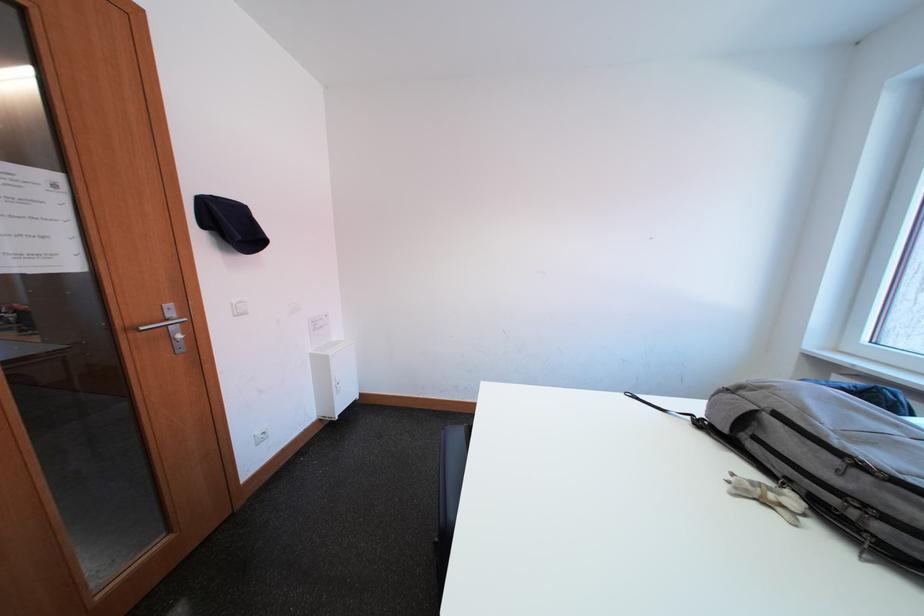
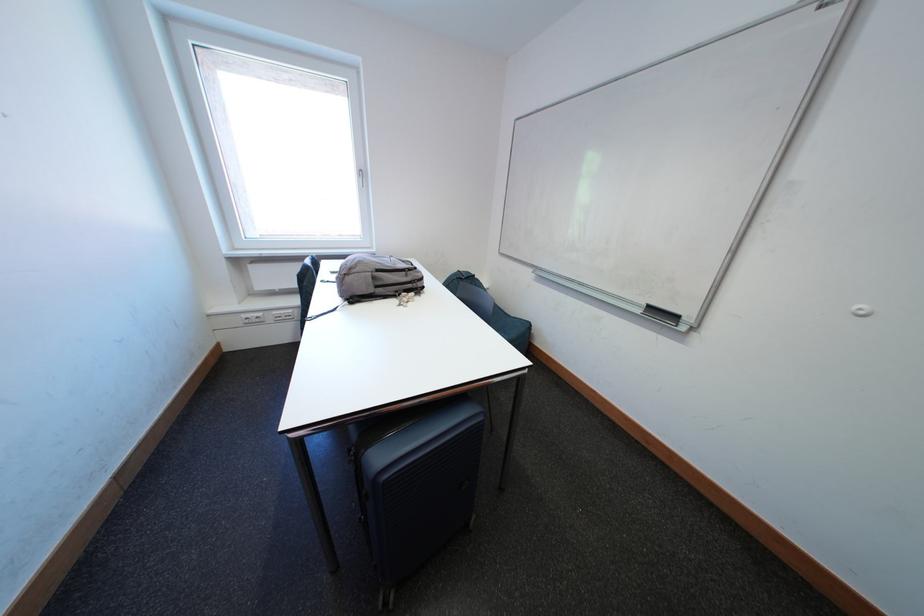
Where in the second image is the point corresponding to point 798,484 from the first image?

(406, 294)